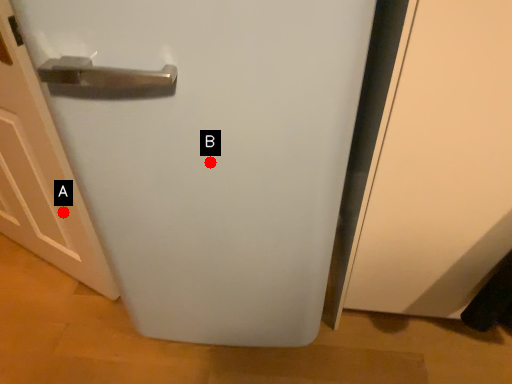
Question: Two points are circled on the image, labeled by A and B beside each circle. Which point appears farthest from the camera in this image?

Choices:
 (A) A is further
 (B) B is further

Answer: (A)